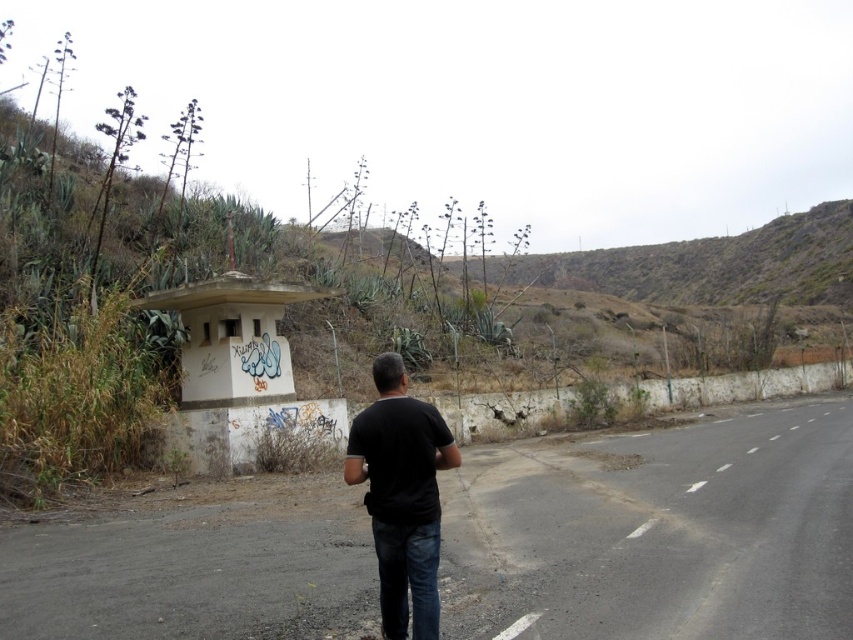
Does point (715, 529) come in front of point (389, 637)?

No, it is behind (389, 637).

Does asphalt road at lower right have a lesser height compared to black matte shirt at center?

Yes, asphalt road at lower right is shorter than black matte shirt at center.

Locate an element on the screen. The height and width of the screenshot is (640, 853). asphalt road at lower right is located at coordinates (666, 531).

Which is behind, point (207, 504) or point (444, 428)?

The point (207, 504) is behind.

Which is behind, point (450, 504) or point (392, 621)?

Positioned behind is point (450, 504).

Image resolution: width=853 pixels, height=640 pixels. What are the coordinates of `smooth asphalt road at center` in the screenshot? It's located at coord(657,531).

Measure the distance between smooth asphalt road at center and asphalt road at lower right.

smooth asphalt road at center and asphalt road at lower right are 81.27 centimeters apart.

Between smooth asphalt road at center and asphalt road at lower right, which one appears on the left side from the viewer's perspective?

Positioned to the left is smooth asphalt road at center.

Based on the photo, who is more distant from viewer, (524, 461) or (519, 516)?

The point (524, 461) is behind.

Where is `smooth asphalt road at center`? This screenshot has height=640, width=853. smooth asphalt road at center is located at coordinates (657, 531).